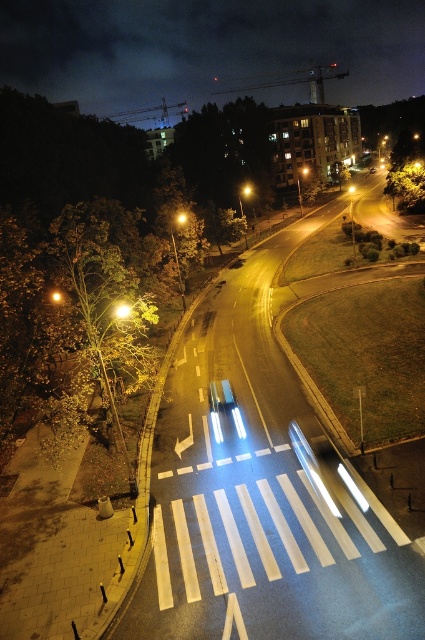
You are a pedestrian waiting at the crosswalk and see both the yellowish glass traffic light at center and the yellow plastic traffic light at center. Which one is nearer to you?

The yellowish glass traffic light at center is closer to you than the yellow plastic traffic light at center.

You are standing at the pedestrian crossing marked with white stripes on the asphalt. You see a shiny silver car at center. Where is the point located at coordinates (221,394) in relation to the shiny silver car at center?

The point located at coordinates (221,394) is on the shiny silver car at center.

You are standing at the pedestrian crossing and want to determine the distance between the two points marked on the road. Given that the road curves to the right and the points are located at coordinates point (184, 220) and point (348, 186), which point is nearer to your current position?

Point (184, 220) is closer to the camera than point (348, 186), so the point (184, 220) is nearer to your current position.